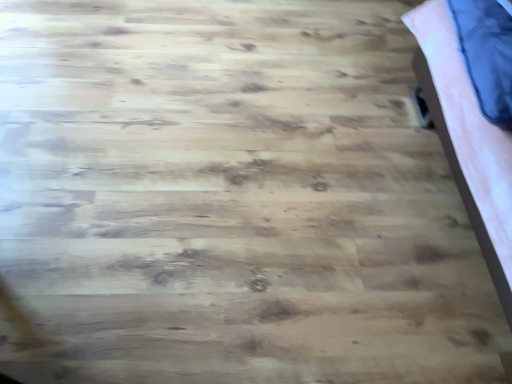
Question: Could you tell me if pink fabric bed at right is turned towards velvety blue pillow at upper right?

Choices:
 (A) yes
 (B) no

Answer: (A)

Question: Is pink fabric bed at right wider than velvety blue pillow at upper right?

Choices:
 (A) yes
 (B) no

Answer: (A)

Question: Is pink fabric bed at right closer to camera compared to velvety blue pillow at upper right?

Choices:
 (A) no
 (B) yes

Answer: (B)

Question: Can you confirm if pink fabric bed at right is taller than velvety blue pillow at upper right?

Choices:
 (A) no
 (B) yes

Answer: (B)

Question: Is pink fabric bed at right far from velvety blue pillow at upper right?

Choices:
 (A) no
 (B) yes

Answer: (A)

Question: Is pink fabric bed at right outside of velvety blue pillow at upper right?

Choices:
 (A) yes
 (B) no

Answer: (A)

Question: Is velvety blue pillow at upper right wider than pink fabric bed at right?

Choices:
 (A) yes
 (B) no

Answer: (B)

Question: Is velvety blue pillow at upper right aimed at pink fabric bed at right?

Choices:
 (A) no
 (B) yes

Answer: (B)

Question: Does velvety blue pillow at upper right have a greater height compared to pink fabric bed at right?

Choices:
 (A) no
 (B) yes

Answer: (A)

Question: Does velvety blue pillow at upper right have a smaller size compared to pink fabric bed at right?

Choices:
 (A) yes
 (B) no

Answer: (A)

Question: Is velvety blue pillow at upper right next to pink fabric bed at right and touching it?

Choices:
 (A) no
 (B) yes

Answer: (A)

Question: Is velvety blue pillow at upper right turned away from pink fabric bed at right?

Choices:
 (A) no
 (B) yes

Answer: (B)

Question: From the image's perspective, is velvety blue pillow at upper right above or below pink fabric bed at right?

Choices:
 (A) below
 (B) above

Answer: (B)